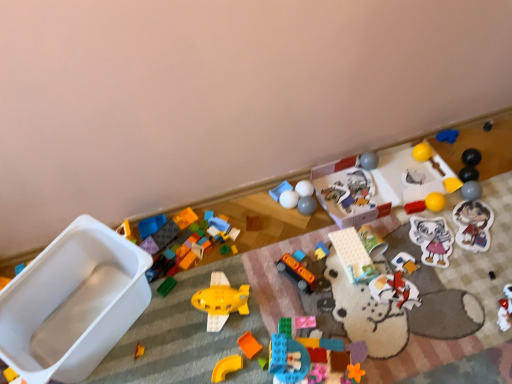
Locate an element on the screen. Image resolution: width=512 pixels, height=384 pixels. free space between orange plastic block at lower left, acting as the 23th toy starting from the right, and orange matte bus at center, the sixteenth toy in the right-to-left sequence is located at coordinates (229, 316).